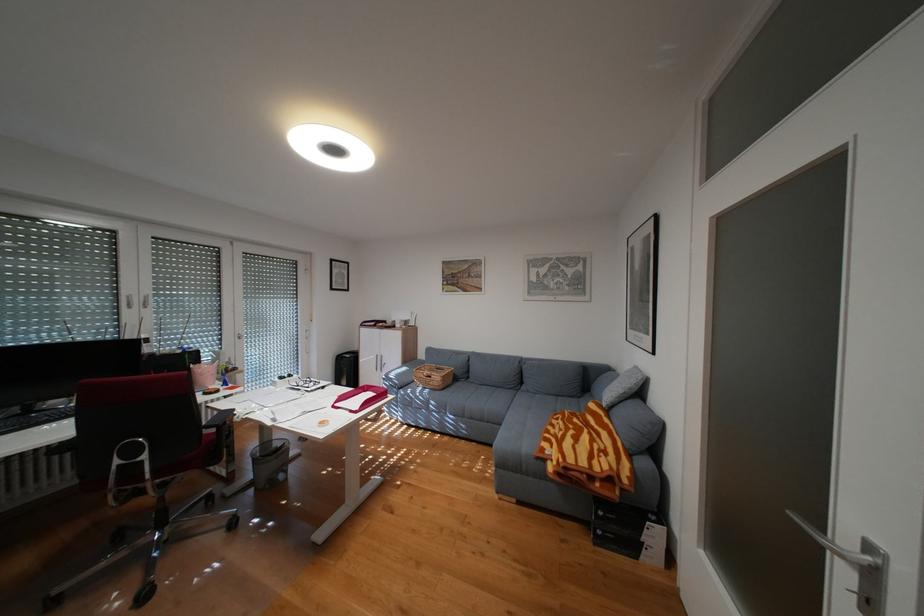
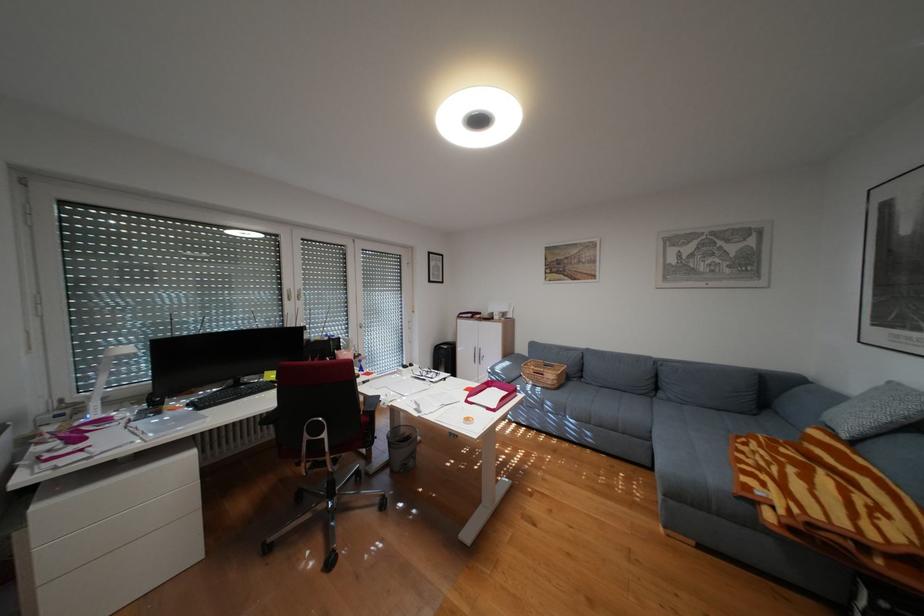
Question: The images are taken continuously from a first-person perspective. In which direction are you moving?

Choices:
 (A) Left
 (B) Right
 (C) Forward
 (D) Backward

Answer: (A)